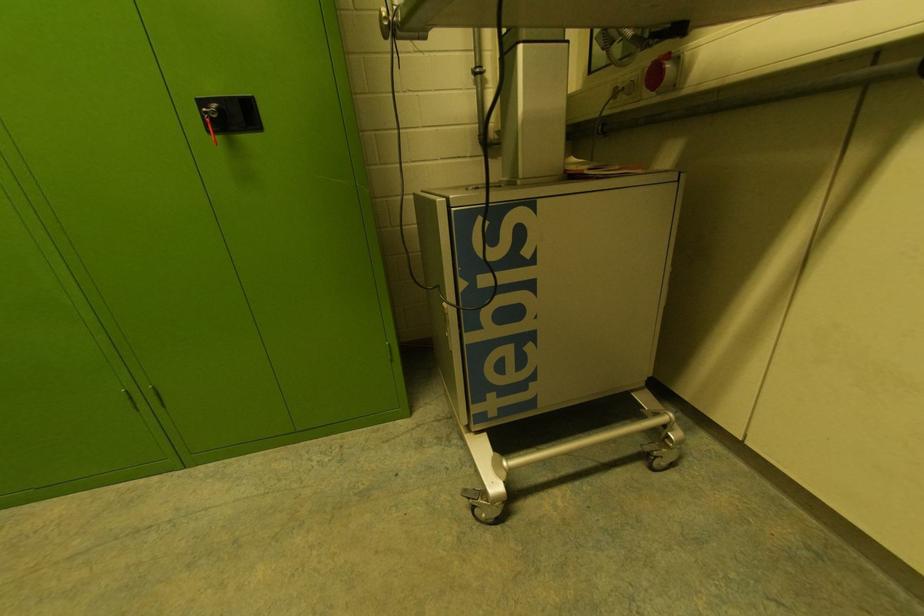
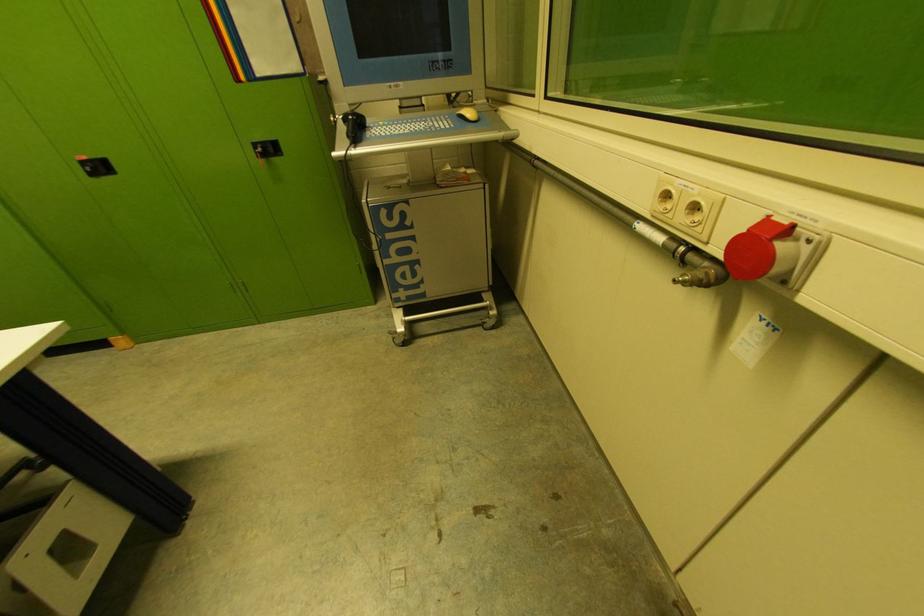
In a continuous first-person perspective shot, in which direction is the camera moving?

The movement direction of the cameraman is right, backward.